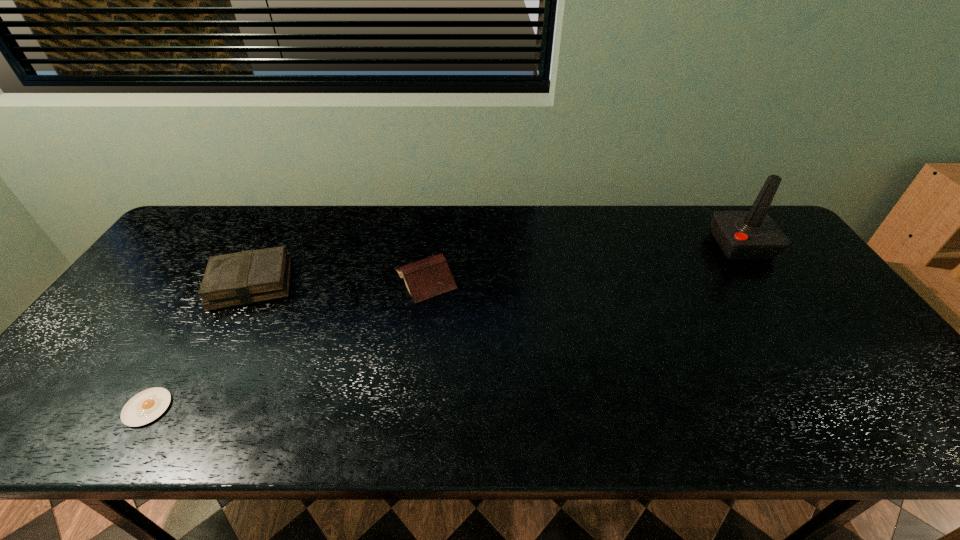
Where is `empty space that is in between the left book and the rightmost object`? The width and height of the screenshot is (960, 540). empty space that is in between the left book and the rightmost object is located at coordinates point(496,264).

The height and width of the screenshot is (540, 960). Find the location of `free space between the tallest object and the second object from right to left`. free space between the tallest object and the second object from right to left is located at coordinates (584, 262).

Identify the location of vacant area that lies between the right book and the shortest object. This screenshot has width=960, height=540. (286, 343).

In order to click on vacant area between the nearest object and the left book in this screenshot , I will do `click(199, 346)`.

Locate an element on the screen. vacant space that's between the left book and the second object from right to left is located at coordinates (338, 281).

Locate an element on the screen. The image size is (960, 540). vacant area between the second object from right to left and the rightmost object is located at coordinates (584, 262).

The image size is (960, 540). I want to click on free spot between the left book and the joystick, so click(x=496, y=264).

At what (x,y) coordinates should I click in order to perform the action: click on free space between the egg yolk and the rightmost object. Please return your answer as a coordinate pair (x, y). Looking at the image, I should click on (444, 326).

Where is `vacant area between the egg yolk and the third object from left to right`? vacant area between the egg yolk and the third object from left to right is located at coordinates (286, 343).

Locate an element on the screen. This screenshot has height=540, width=960. object identified as the second closest to the joystick is located at coordinates (247, 277).